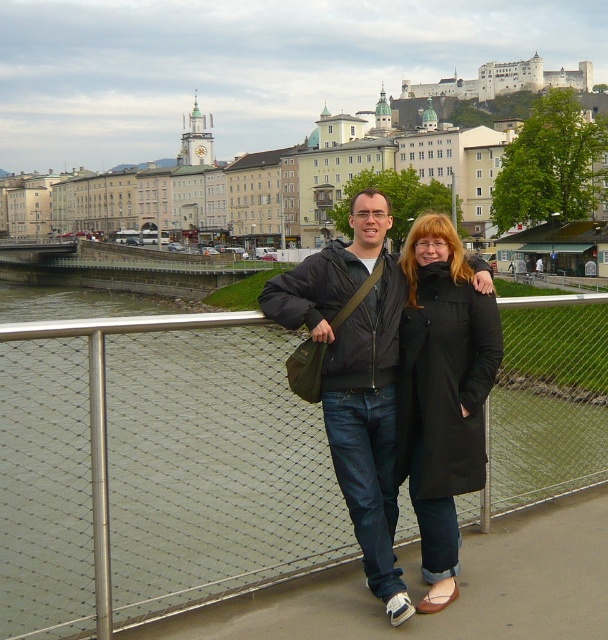
In the scene shown: Between metal mesh fence at center and black matte jacket at center, which one has less height?

Standing shorter between the two is metal mesh fence at center.

Find the location of a particular element. This screenshot has height=640, width=608. metal mesh fence at center is located at coordinates (153, 470).

You are a GUI agent. You are given a task and a screenshot of the screen. Output one action in this format:
    pyautogui.click(x=<x>, y=<y>)
    Task: Click on the metal mesh fence at center
    This screenshot has height=640, width=608.
    Given the screenshot: What is the action you would take?
    pyautogui.click(x=153, y=470)

The image size is (608, 640). I want to click on metal mesh fence at center, so click(x=153, y=470).

Between metal mesh fence at center and black matte coat at center, which one appears on the left side from the viewer's perspective?

black matte coat at center is more to the left.

Which is above, metal mesh fence at center or black matte coat at center?

Positioned higher is metal mesh fence at center.

Does point (103, 355) come farther from viewer compared to point (426, 531)?

No.

This screenshot has width=608, height=640. I want to click on metal mesh fence at center, so click(153, 470).

Which of these two, black matte coat at center or black matte jacket at center, stands shorter?

black matte coat at center is shorter.

This screenshot has width=608, height=640. What do you see at coordinates (443, 392) in the screenshot?
I see `black matte coat at center` at bounding box center [443, 392].

Is point (499, 330) positioned behind point (418, 236)?

No, it is in front of (418, 236).

Identify the location of black matte coat at center. (443, 392).